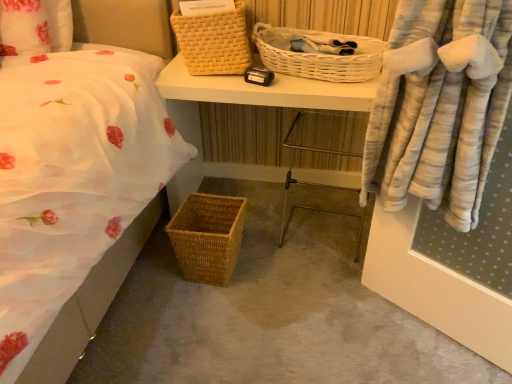
Find the location of a particular element. This screenshot has width=512, height=384. free space to the right of woven brown picnic basket at lower left, the first picnic basket positioned from the bottom is located at coordinates (264, 270).